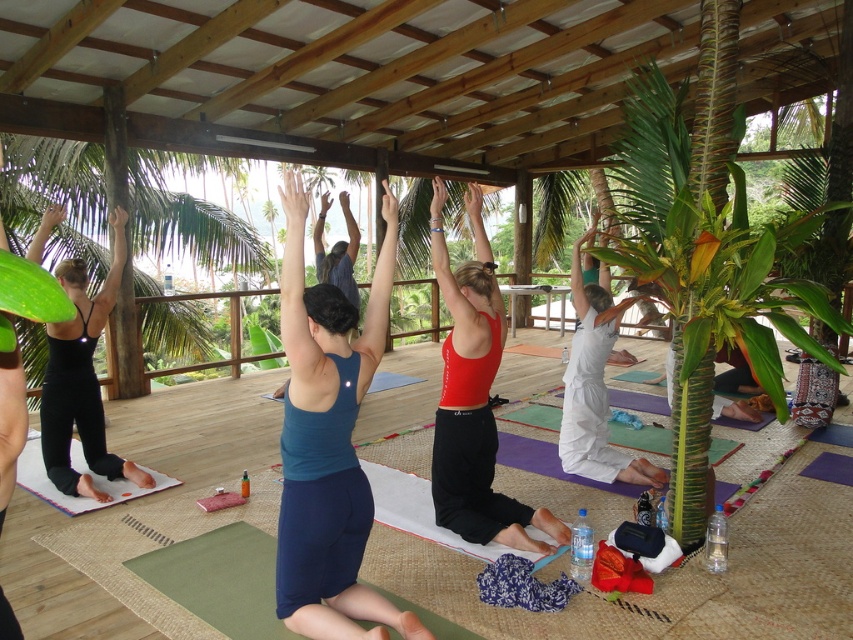
Question: Among these points, which one is nearest to the camera?

Choices:
 (A) (463, 481)
 (B) (335, 362)

Answer: (B)

Question: Which of the following is the farthest from the observer?

Choices:
 (A) (578, 396)
 (B) (62, 369)
 (C) (306, 417)
 (D) (469, 435)

Answer: (A)

Question: Is blue fabric yoga mat at center bigger than black matte yoga pants at left?

Choices:
 (A) no
 (B) yes

Answer: (A)

Question: Does blue fabric yoga mat at center appear over white cotton yoga pants at lower right?

Choices:
 (A) no
 (B) yes

Answer: (A)

Question: Which of the following is the closest to the observer?

Choices:
 (A) black matte yoga pants at left
 (B) red matte tank top at center
 (C) white cotton yoga pants at lower right

Answer: (B)

Question: Does red matte tank top at center appear on the right side of black matte yoga pants at left?

Choices:
 (A) yes
 (B) no

Answer: (A)